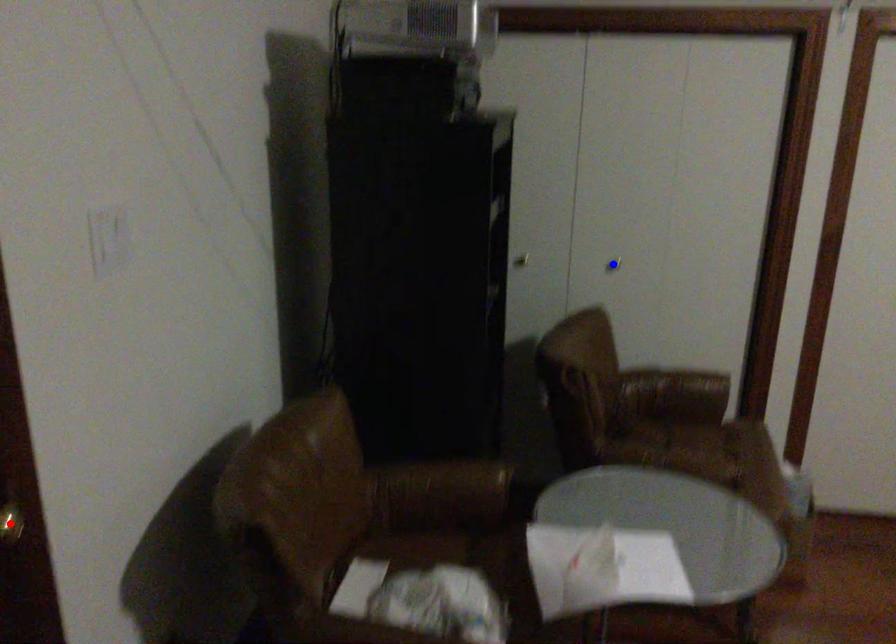
Question: Which of the two points in the image is closer to the camera?

Choices:
 (A) Blue point is closer.
 (B) Red point is closer.

Answer: (B)